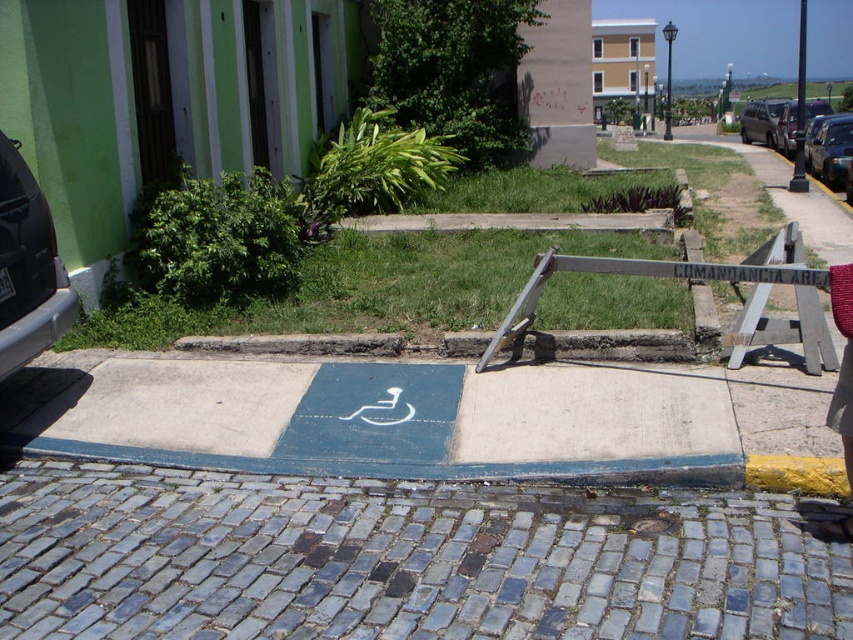
You are a person in a wheelchair navigating the parking area. You see the blue cobblestone pavement at lower center and the wooden sign at center. Which surface would require you to climb over?

The wooden sign at center requires climbing over because it is higher than the blue cobblestone pavement at lower center.

From the picture: You are a delivery person needing to park your van in the parking area. The blue cobblestone pavement at lower center is the designated parking spot. Can you park your van there if the shiny black car at right is blocking access?

The blue cobblestone pavement at lower center is below shiny black car at right, meaning the car is blocking the parking spot. Therefore, you cannot park your van there until the shiny black car at right moves.